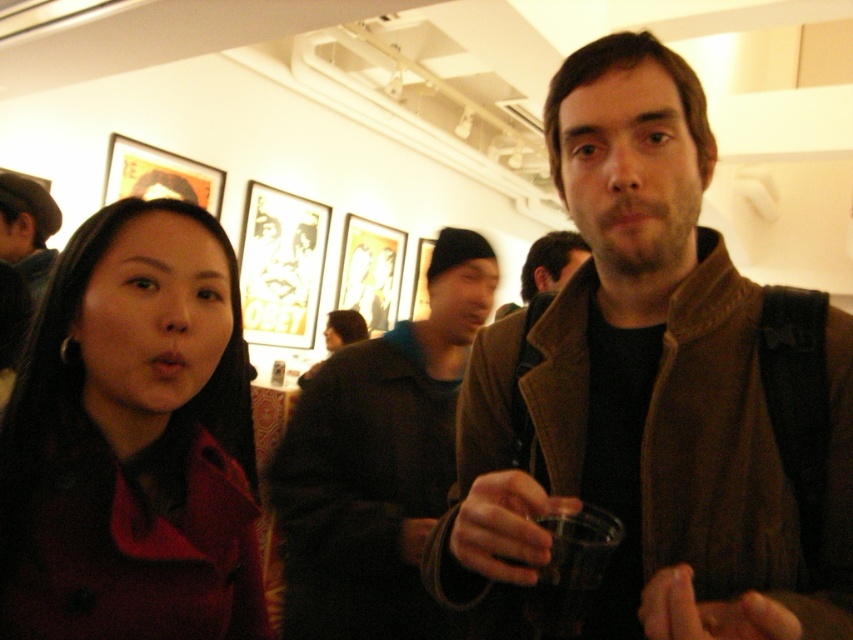
Question: Considering the real-world distances, which object is farthest from the brown leather jacket at center?

Choices:
 (A) matte red coat at left
 (B) dark brown woolen jacket at center

Answer: (B)

Question: Can you confirm if brown leather jacket at center is positioned above matte red coat at left?

Choices:
 (A) yes
 (B) no

Answer: (A)

Question: Does brown leather jacket at center have a lesser width compared to transparent plastic cup at center?

Choices:
 (A) no
 (B) yes

Answer: (A)

Question: Which point is farther to the camera?

Choices:
 (A) (91, 381)
 (B) (602, 371)

Answer: (B)

Question: Does brown leather jacket at center come behind transparent plastic cup at center?

Choices:
 (A) yes
 (B) no

Answer: (B)

Question: Estimate the real-world distances between objects in this image. Which object is farther from the transparent plastic cup at center?

Choices:
 (A) dark brown woolen jacket at center
 (B) brown leather jacket at center

Answer: (A)